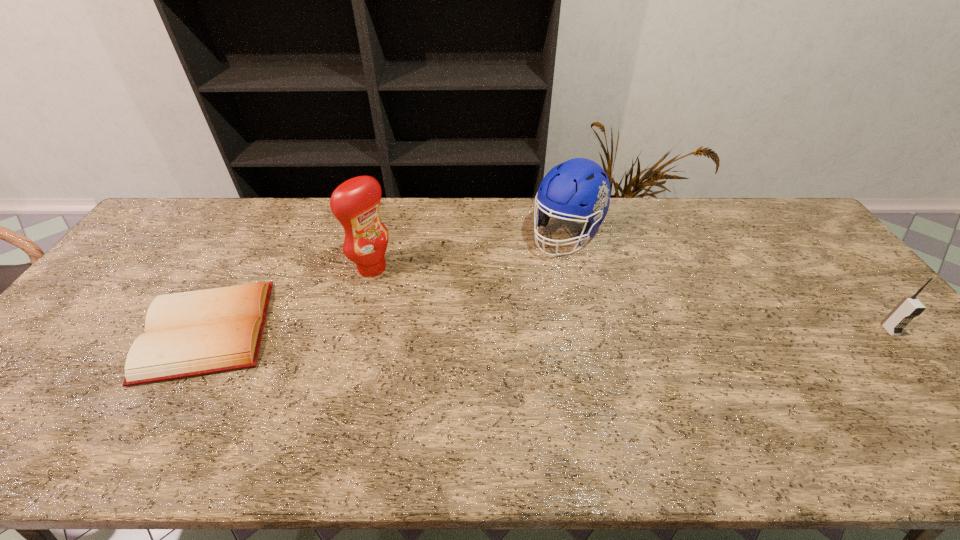
Where is `Bible`? The height and width of the screenshot is (540, 960). Bible is located at coordinates coord(200,332).

Where is `the shortest object`? The image size is (960, 540). the shortest object is located at coordinates (200, 332).

Locate an element on the screen. This screenshot has height=540, width=960. the third tallest object is located at coordinates (909, 307).

The width and height of the screenshot is (960, 540). What are the coordinates of `cellular telephone` in the screenshot? It's located at (909, 307).

Where is `the second tallest object`? The width and height of the screenshot is (960, 540). the second tallest object is located at coordinates (579, 188).

You are a GUI agent. You are given a task and a screenshot of the screen. Output one action in this format:
    pyautogui.click(x=<x>, y=<y>)
    Task: Click on the football helmet
    
    Given the screenshot: What is the action you would take?
    pyautogui.click(x=579, y=188)

The image size is (960, 540). I want to click on condiment, so click(x=355, y=203).

You are a GUI agent. You are given a task and a screenshot of the screen. Output one action in this format:
    pyautogui.click(x=<x>, y=<y>)
    Task: Click on the vacant space located on the left of the Bible
    The height and width of the screenshot is (540, 960).
    Given the screenshot: What is the action you would take?
    pyautogui.click(x=73, y=330)

Where is `blank space located on the front-facing side of the cellular telephone`? The image size is (960, 540). blank space located on the front-facing side of the cellular telephone is located at coordinates pyautogui.click(x=945, y=394).

What are the coordinates of `free point located on the face guard of the second tallest object` in the screenshot? It's located at (540, 264).